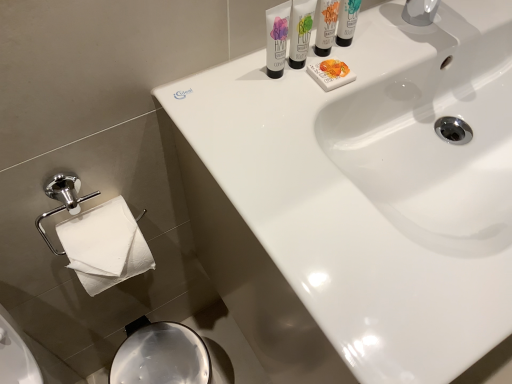
Question: Which direction should I rotate to look at matte white shaving cream at upper center, the second shaving cream in the right-to-left sequence?

Choices:
 (A) left
 (B) right

Answer: (B)

Question: Is white glossy tube at upper center, arranged as the third shaving cream when viewed from the right, taller than matte white shaving cream at upper right, which is the 1th shaving cream in right-to-left order?

Choices:
 (A) yes
 (B) no

Answer: (B)

Question: From the image's perspective, would you say white glossy tube at upper center, arranged as the 1th shaving cream when viewed from the left, is shown under matte white shaving cream at upper right, which is the 1th shaving cream in right-to-left order?

Choices:
 (A) yes
 (B) no

Answer: (A)

Question: Is white glossy tube at upper center, arranged as the 1th shaving cream when viewed from the left, to the right of matte white shaving cream at upper right, the 3th shaving cream from the left, from the viewer's perspective?

Choices:
 (A) yes
 (B) no

Answer: (B)

Question: Considering the relative positions of white glossy tube at upper center, arranged as the 1th shaving cream when viewed from the left, and matte white shaving cream at upper right, which is the 1th shaving cream in right-to-left order, in the image provided, is white glossy tube at upper center, arranged as the 1th shaving cream when viewed from the left, behind matte white shaving cream at upper right, which is the 1th shaving cream in right-to-left order,?

Choices:
 (A) yes
 (B) no

Answer: (B)

Question: Does white glossy tube at upper center, arranged as the third shaving cream when viewed from the right, have a smaller size compared to matte white shaving cream at upper right, the 3th shaving cream from the left?

Choices:
 (A) no
 (B) yes

Answer: (A)

Question: Can you confirm if white glossy tube at upper center, arranged as the third shaving cream when viewed from the right, is thinner than matte white shaving cream at upper right, the 3th shaving cream from the left?

Choices:
 (A) no
 (B) yes

Answer: (A)

Question: Can you confirm if white glossy sink at upper center is shorter than white matte soap at upper center?

Choices:
 (A) yes
 (B) no

Answer: (B)

Question: Could you tell me if white glossy sink at upper center is facing white matte soap at upper center?

Choices:
 (A) no
 (B) yes

Answer: (A)

Question: From the image's perspective, is white glossy sink at upper center located beneath white matte soap at upper center?

Choices:
 (A) no
 (B) yes

Answer: (B)

Question: Can you confirm if white glossy sink at upper center is positioned to the right of white matte soap at upper center?

Choices:
 (A) no
 (B) yes

Answer: (B)

Question: From a real-world perspective, is white glossy sink at upper center located beneath white matte soap at upper center?

Choices:
 (A) yes
 (B) no

Answer: (A)

Question: Is white glossy sink at upper center bigger than white matte soap at upper center?

Choices:
 (A) yes
 (B) no

Answer: (A)

Question: Considering the relative sizes of white glossy tube at upper center, arranged as the third shaving cream when viewed from the right, and matte white shaving cream at upper center, the 2th shaving cream viewed from the left, in the image provided, is white glossy tube at upper center, arranged as the third shaving cream when viewed from the right, shorter than matte white shaving cream at upper center, the 2th shaving cream viewed from the left,?

Choices:
 (A) no
 (B) yes

Answer: (B)